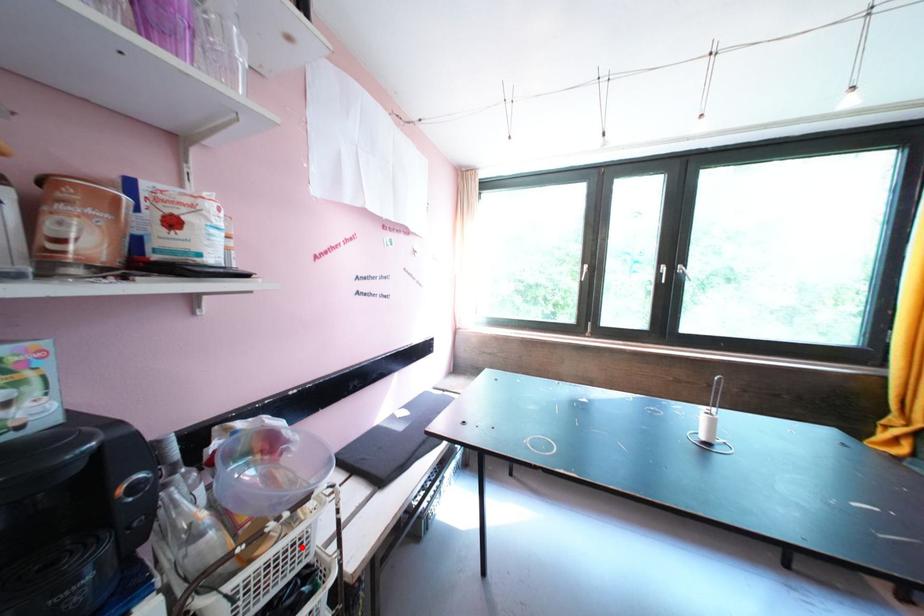
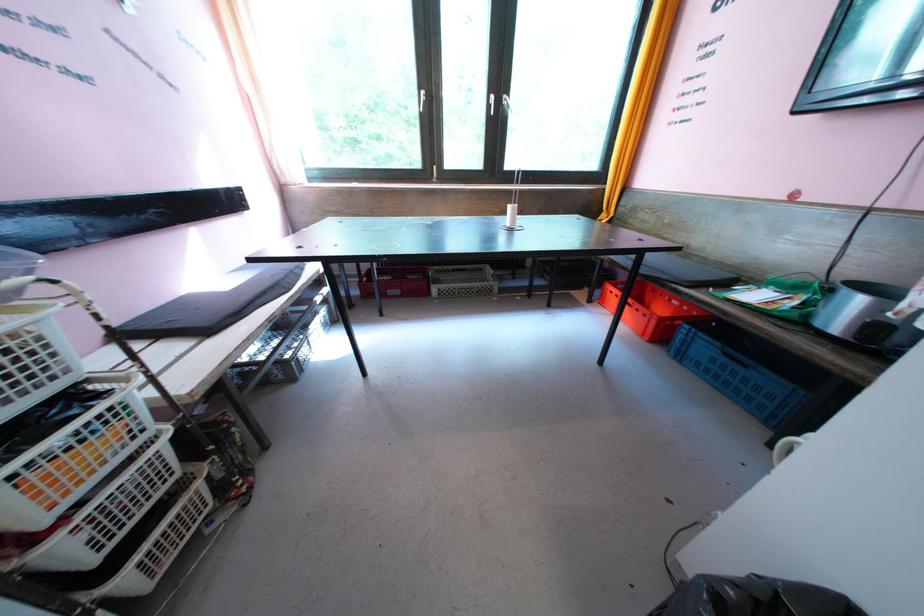
Question: I am providing you with two images of the same scene from different viewpoints. Given a red point in image1, look at the same physical point in image2. Is it:

Choices:
 (A) Closer to the viewpoint
 (B) Farther from the viewpoint

Answer: (B)